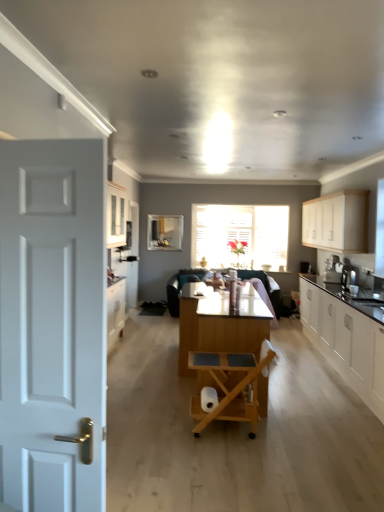
Question: Relative to white glossy cabinets at right, which is the 1th cabinetry in bottom-to-top order, is white matte toilet paper at center in front or behind?

Choices:
 (A) behind
 (B) front

Answer: (A)

Question: From a real-world perspective, relative to white glossy cabinets at right, which is the 1th cabinetry in bottom-to-top order, is white matte toilet paper at center vertically above or below?

Choices:
 (A) above
 (B) below

Answer: (B)

Question: Which object is the closest to the wooden rolling chair at center?

Choices:
 (A) white matte toilet paper at center
 (B) white glossy cabinets at right, acting as the 2th cabinetry starting from the top
 (C) translucent glass window at center
 (D) clear glass window screen at center
 (E) wooden table at center

Answer: (A)

Question: Estimate the real-world distances between objects in this image. Which object is farther from the white glossy cabinets at right, which is the 1th cabinetry in bottom-to-top order?

Choices:
 (A) wooden table at center
 (B) satin black coffee machine at right
 (C) wooden rolling chair at center
 (D) translucent glass window at center
 (E) white matte toilet paper at center

Answer: (D)